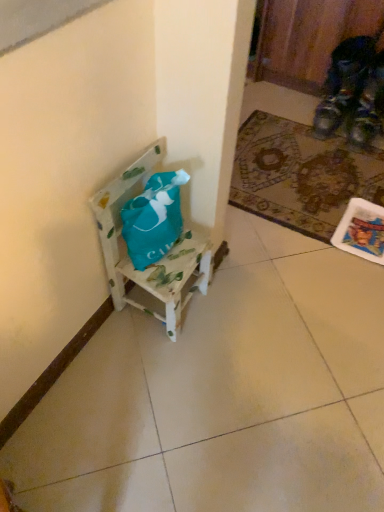
Question: Considering the relative positions of wooden painted chair at center and patterned carpet at lower right in the image provided, is wooden painted chair at center to the right of patterned carpet at lower right from the viewer's perspective?

Choices:
 (A) yes
 (B) no

Answer: (B)

Question: Considering the relative sizes of wooden painted chair at center and patterned carpet at lower right in the image provided, is wooden painted chair at center taller than patterned carpet at lower right?

Choices:
 (A) no
 (B) yes

Answer: (B)

Question: Are wooden painted chair at center and patterned carpet at lower right beside each other?

Choices:
 (A) no
 (B) yes

Answer: (A)

Question: Is wooden painted chair at center in front of patterned carpet at lower right?

Choices:
 (A) yes
 (B) no

Answer: (A)

Question: Is wooden painted chair at center facing towards patterned carpet at lower right?

Choices:
 (A) yes
 (B) no

Answer: (B)

Question: Does wooden painted chair at center have a lesser height compared to patterned carpet at lower right?

Choices:
 (A) yes
 (B) no

Answer: (B)

Question: Is patterned carpet at lower right at the left side of wooden painted chair at center?

Choices:
 (A) yes
 (B) no

Answer: (B)

Question: Are patterned carpet at lower right and wooden painted chair at center making contact?

Choices:
 (A) no
 (B) yes

Answer: (A)

Question: Does patterned carpet at lower right have a greater width compared to wooden painted chair at center?

Choices:
 (A) no
 (B) yes

Answer: (B)

Question: Does patterned carpet at lower right have a larger size compared to wooden painted chair at center?

Choices:
 (A) yes
 (B) no

Answer: (B)

Question: Is patterned carpet at lower right smaller than wooden painted chair at center?

Choices:
 (A) no
 (B) yes

Answer: (B)

Question: From the image's perspective, would you say patterned carpet at lower right is shown under wooden painted chair at center?

Choices:
 (A) no
 (B) yes

Answer: (A)

Question: Is patterned carpet at lower right wider or thinner than wooden painted chair at center?

Choices:
 (A) wide
 (B) thin

Answer: (A)